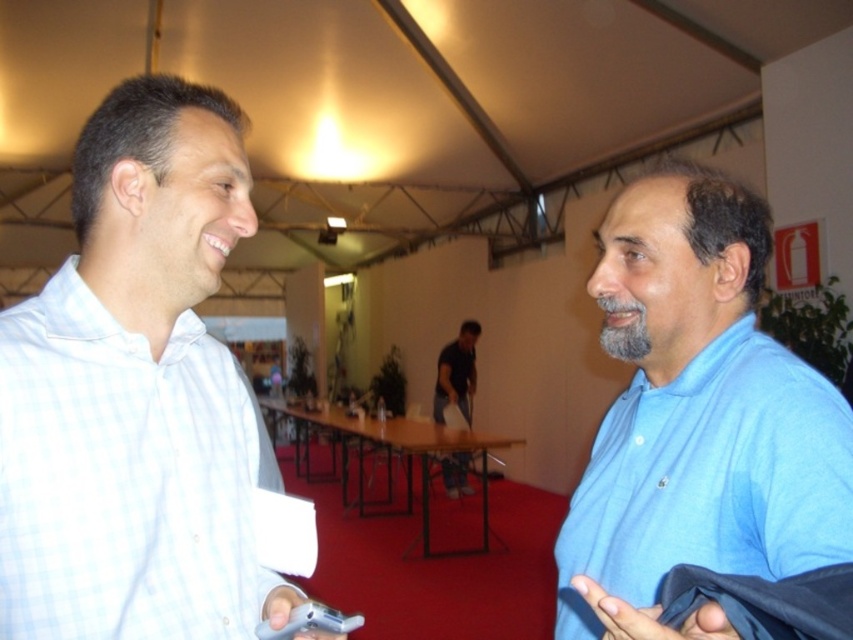
You are organizing a clothing donation drive and need to categorize shirts by size. You have two shirts to sort out. The white checkered shirt at left and the dark blue shirt at center. Which shirt should be placed in the small size bin?

The white checkered shirt at left has a smaller size compared to dark blue shirt at center, so it should be placed in the small size bin.

Based on the photo, you are a photographer positioned at the entrance of the tent. You want to take a photo of both the blue cotton shirt at right and the dark blue shirt at center without moving either person. Based on their positions, which person should you focus on first to ensure both are in frame?

The blue cotton shirt at right is to the right of the dark blue shirt at center, so you should focus on the dark blue shirt at center first to ensure both are in frame.

You are at the point labeled as point (115,593) and want to walk towards the point labeled as point (706,205). Based on the scene description, will you have to walk forward or backward to reach your destination?

Since point (115,593) is in front of point (706,205), you would need to walk backward to reach point (706,205) from your current position at point (115,593).